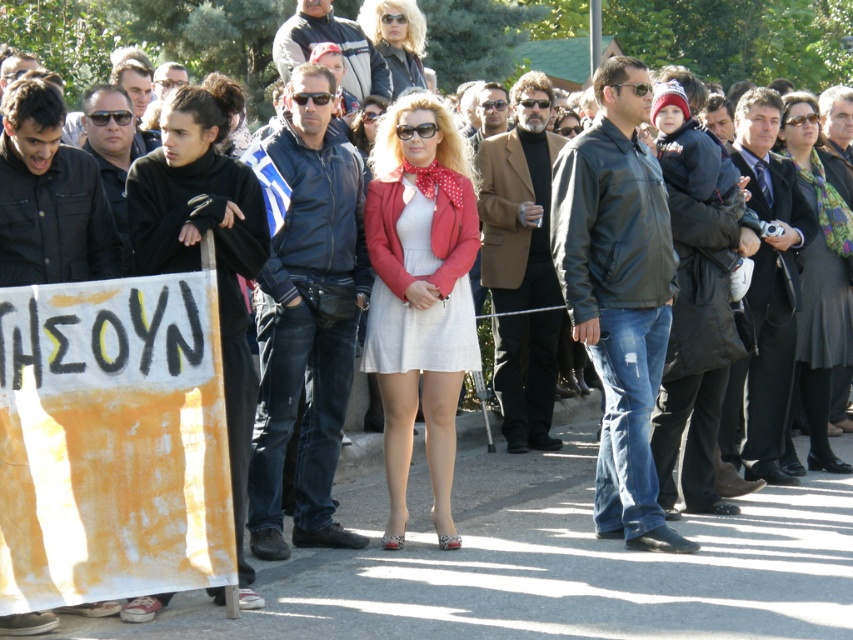
Question: Which point appears closest to the camera in this image?

Choices:
 (A) (204, 104)
 (B) (416, 26)
 (C) (436, 314)

Answer: (A)

Question: Is matte red jacket at center to the left of black matte coat at left from the viewer's perspective?

Choices:
 (A) no
 (B) yes

Answer: (A)

Question: Estimate the real-world distances between objects in this image. Which object is farther from the black matte coat at left?

Choices:
 (A) matte red jacket at center
 (B) leather jacket at center
 (C) dark gray wool coat at center

Answer: (B)

Question: Which object appears closest to the camera in this image?

Choices:
 (A) leather jacket at center
 (B) black matte coat at left
 (C) matte red jacket at center

Answer: (B)

Question: Can you confirm if black matte coat at left is wider than leather jacket at center?

Choices:
 (A) yes
 (B) no

Answer: (A)

Question: Does black matte coat at left appear over dark gray wool coat at center?

Choices:
 (A) no
 (B) yes

Answer: (A)